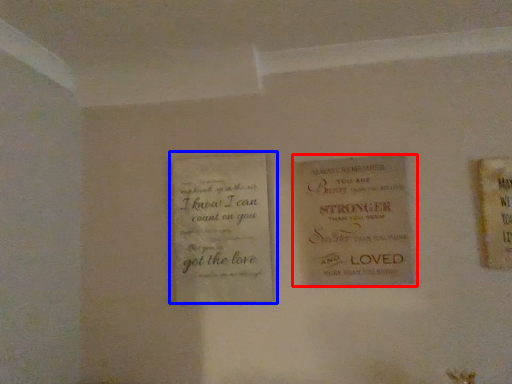
Question: Which point is closer to the camera, book (highlighted by a red box) or book (highlighted by a blue box)?

Choices:
 (A) book
 (B) book

Answer: (A)